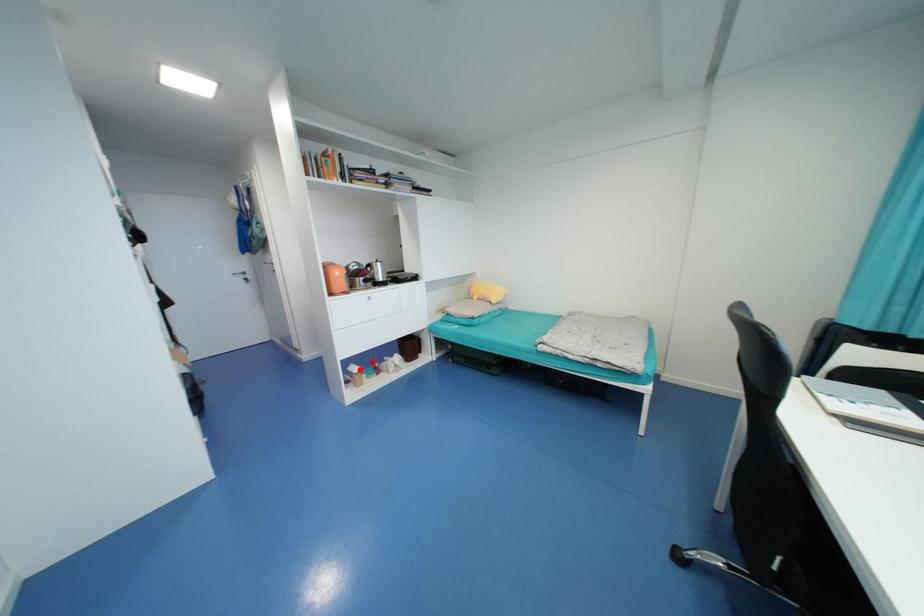
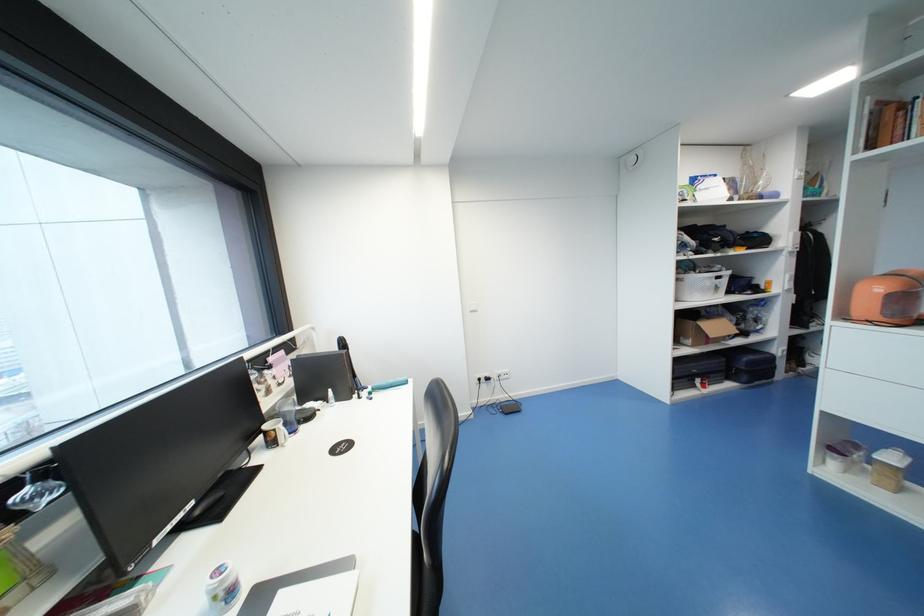
Question: I am providing you with two images of the same scene from different viewpoints. A red point is shown in image1. For the corresponding object point in image2, is it positioned nearer or farther from the camera?

Choices:
 (A) Nearer
 (B) Farther

Answer: (B)